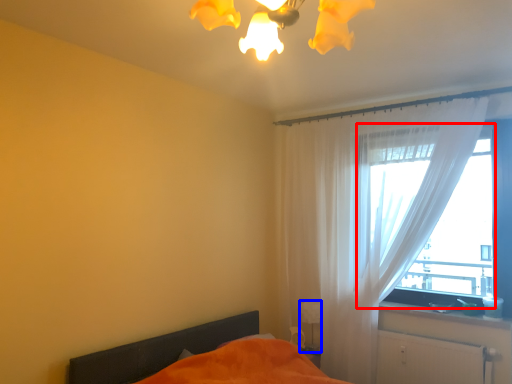
Question: Which object is further to the camera taking this photo, window (highlighted by a red box) or table lamp (highlighted by a blue box)?

Choices:
 (A) window
 (B) table lamp

Answer: (B)